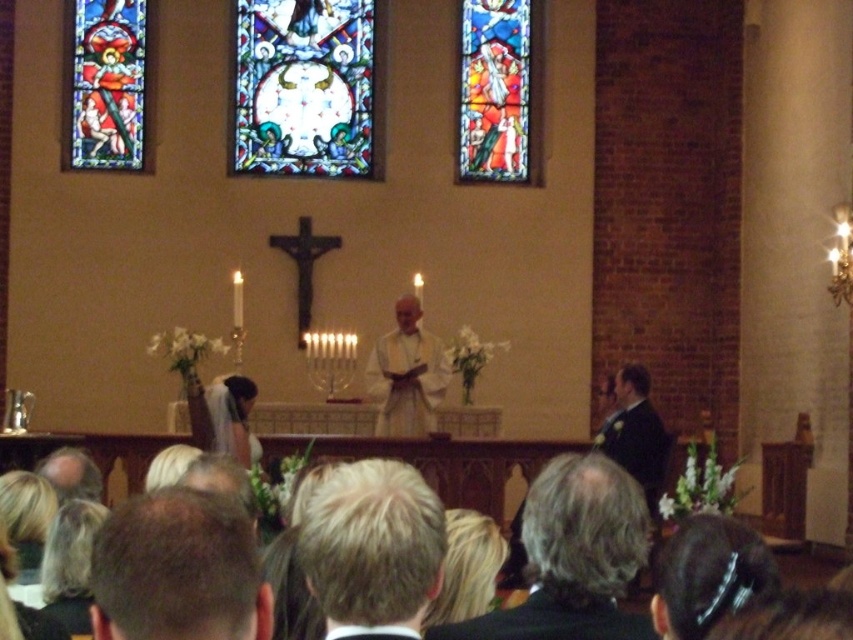
Can you confirm if blonde hair at center is smaller than white satin veil at upper center?

No, blonde hair at center is not smaller than white satin veil at upper center.

Does blonde hair at center appear under white satin veil at upper center?

Yes, blonde hair at center is below white satin veil at upper center.

Describe the element at coordinates (372, 548) in the screenshot. I see `blonde hair at center` at that location.

You are a GUI agent. You are given a task and a screenshot of the screen. Output one action in this format:
    pyautogui.click(x=<x>, y=<y>)
    Task: Click on the blonde hair at center
    
    Given the screenshot: What is the action you would take?
    pyautogui.click(x=372, y=548)

Can you confirm if stained glass window at center is wider than white satin veil at upper center?

Correct, the width of stained glass window at center exceeds that of white satin veil at upper center.

Who is positioned more to the left, stained glass window at center or white satin veil at upper center?

Positioned to the left is white satin veil at upper center.

Between point (345, 122) and point (207, 406), which one is positioned in front?

Point (207, 406) is in front.

You are a GUI agent. You are given a task and a screenshot of the screen. Output one action in this format:
    pyautogui.click(x=<x>, y=<y>)
    Task: Click on the stained glass window at center
    The image size is (853, 640).
    Given the screenshot: What is the action you would take?
    pyautogui.click(x=305, y=88)

Which is more to the left, blonde hair at center or stained glass window at upper center?

Positioned to the left is blonde hair at center.

Locate an element on the screen. blonde hair at center is located at coordinates (372, 548).

You are a GUI agent. You are given a task and a screenshot of the screen. Output one action in this format:
    pyautogui.click(x=<x>, y=<y>)
    Task: Click on the blonde hair at center
    
    Given the screenshot: What is the action you would take?
    pyautogui.click(x=372, y=548)